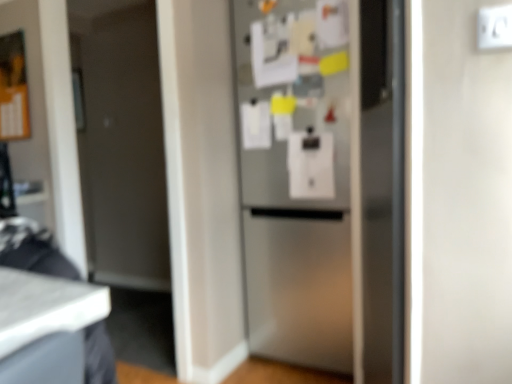
Question: From a real-world perspective, relative to satin silver refrigerator at center, is white plastic electric outlet at upper right vertically above or below?

Choices:
 (A) above
 (B) below

Answer: (A)

Question: In the image, is white plastic electric outlet at upper right on the left side or the right side of satin silver refrigerator at center?

Choices:
 (A) left
 (B) right

Answer: (B)

Question: Is white plastic electric outlet at upper right wider or thinner than satin silver refrigerator at center?

Choices:
 (A) thin
 (B) wide

Answer: (A)

Question: Based on their sizes in the image, would you say satin silver refrigerator at center is bigger or smaller than white plastic electric outlet at upper right?

Choices:
 (A) small
 (B) big

Answer: (B)

Question: Is point (x=267, y=43) closer or farther from the camera than point (x=501, y=29)?

Choices:
 (A) farther
 (B) closer

Answer: (A)

Question: From the image's perspective, is satin silver refrigerator at center positioned above or below white plastic electric outlet at upper right?

Choices:
 (A) above
 (B) below

Answer: (B)

Question: From a real-world perspective, is satin silver refrigerator at center above or below white plastic electric outlet at upper right?

Choices:
 (A) below
 (B) above

Answer: (A)